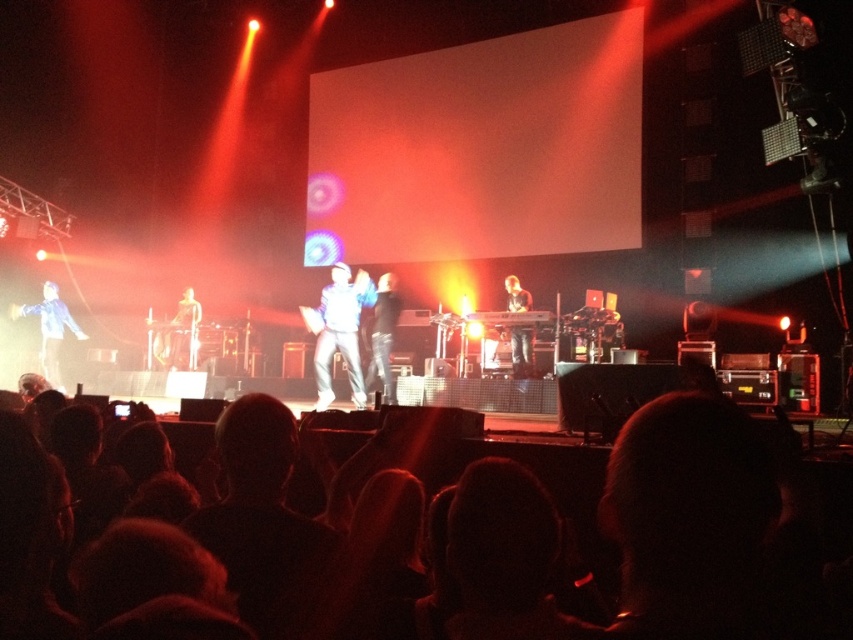
You are at the concert and want to move from the point at coordinates point (280, 428) to the point at coordinates point (181, 332). Which direction should you move to get closer to your destination?

You should move backward because point (280, 428) is in front of point (181, 332), meaning your destination is behind your current position.